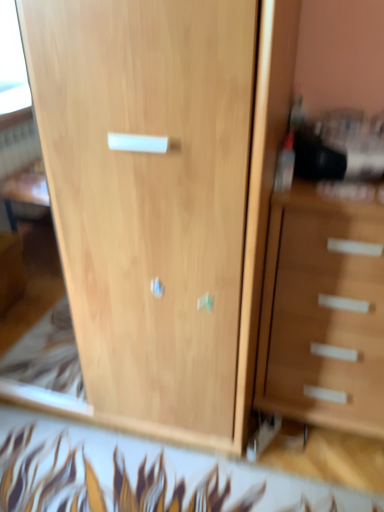
Question: From the image's perspective, is wooden chest of drawers at right located above or below light wood cupboard at center?

Choices:
 (A) above
 (B) below

Answer: (B)

Question: From a real-world perspective, is wooden chest of drawers at right above or below light wood cupboard at center?

Choices:
 (A) above
 (B) below

Answer: (B)

Question: In the image, is wooden chest of drawers at right positioned in front of or behind light wood cupboard at center?

Choices:
 (A) behind
 (B) front

Answer: (A)

Question: Considering the positions of light wood cupboard at center and wooden chest of drawers at right in the image, is light wood cupboard at center bigger or smaller than wooden chest of drawers at right?

Choices:
 (A) big
 (B) small

Answer: (A)

Question: From a real-world perspective, is light wood cupboard at center above or below wooden chest of drawers at right?

Choices:
 (A) below
 (B) above

Answer: (B)

Question: Does point (193, 115) appear closer or farther from the camera than point (299, 267)?

Choices:
 (A) farther
 (B) closer

Answer: (B)

Question: From the image's perspective, is light wood cupboard at center positioned above or below wooden chest of drawers at right?

Choices:
 (A) below
 (B) above

Answer: (B)